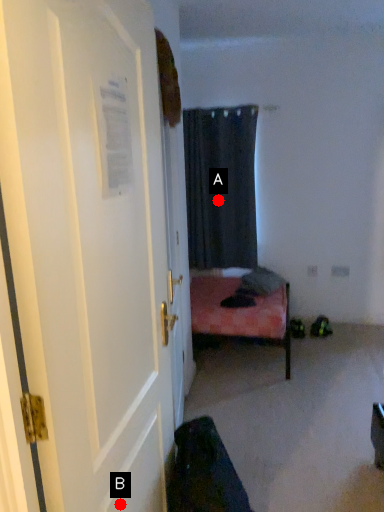
Question: Two points are circled on the image, labeled by A and B beside each circle. Which of the following is the farthest from the observer?

Choices:
 (A) A is further
 (B) B is further

Answer: (A)